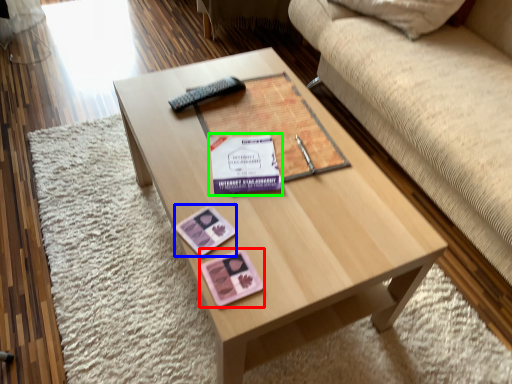
Question: Based on their relative distances, which object is nearer to currency (highlighted by a red box)? Choose from currency (highlighted by a blue box) and paperback book (highlighted by a green box).

Choices:
 (A) currency
 (B) paperback book

Answer: (A)